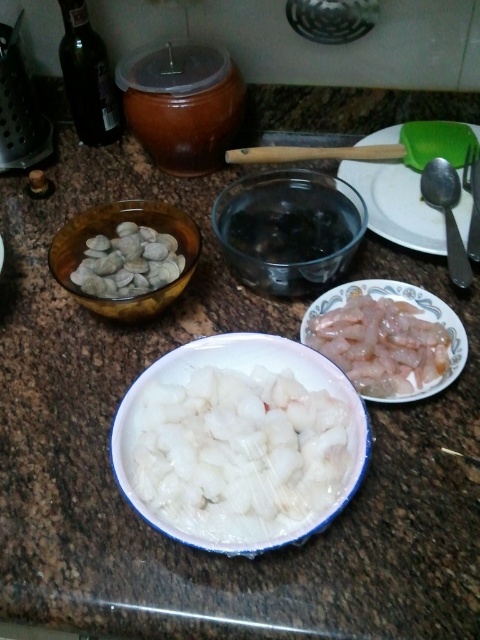
Question: Observing the image, what is the correct spatial positioning of white glossy plate at upper right in reference to satin silver spoon at right?

Choices:
 (A) left
 (B) right

Answer: (A)

Question: Estimate the real-world distances between objects in this image. Which object is farther from the white translucent cubes at center?

Choices:
 (A) wooden bowl at left
 (B) transparent glass bowl at center

Answer: (B)

Question: Which object is closer to the camera taking this photo?

Choices:
 (A) wooden bowl at left
 (B) white glossy shellfish at left
 (C) white glossy plate at upper right

Answer: (A)

Question: Can you confirm if translucent white shrimp at right is thinner than wooden bowl at left?

Choices:
 (A) no
 (B) yes

Answer: (B)

Question: Considering the real-world distances, which object is farthest from the wooden bowl at left?

Choices:
 (A) transparent glass bowl at center
 (B) satin silver spoon at right

Answer: (B)

Question: Is white translucent cubes at center thinner than transparent glass bowl at center?

Choices:
 (A) yes
 (B) no

Answer: (B)